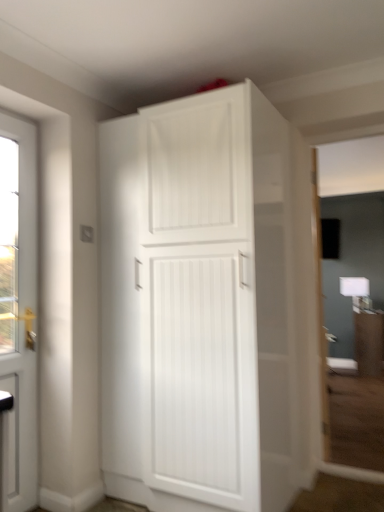
Question: Considering the relative sizes of matte white cabinet at center and white matte cabinet at upper center in the image provided, is matte white cabinet at center thinner than white matte cabinet at upper center?

Choices:
 (A) yes
 (B) no

Answer: (A)

Question: Considering the relative positions of matte white cabinet at center and white matte cabinet at upper center in the image provided, is matte white cabinet at center to the right of white matte cabinet at upper center from the viewer's perspective?

Choices:
 (A) no
 (B) yes

Answer: (B)

Question: Considering the relative sizes of matte white cabinet at center and white matte cabinet at upper center in the image provided, is matte white cabinet at center shorter than white matte cabinet at upper center?

Choices:
 (A) yes
 (B) no

Answer: (A)

Question: From the image's perspective, is matte white cabinet at center on white matte cabinet at upper center?

Choices:
 (A) no
 (B) yes

Answer: (A)

Question: From the image's perspective, does matte white cabinet at center appear lower than white matte cabinet at upper center?

Choices:
 (A) yes
 (B) no

Answer: (A)

Question: Considering the positions of point (11, 144) and point (360, 359), is point (11, 144) closer or farther from the camera than point (360, 359)?

Choices:
 (A) closer
 (B) farther

Answer: (A)

Question: Visually, is white glossy door at left positioned to the left or to the right of matte white cabinet at center?

Choices:
 (A) right
 (B) left

Answer: (B)

Question: Looking at the image, does white glossy door at left seem bigger or smaller compared to matte white cabinet at center?

Choices:
 (A) small
 (B) big

Answer: (A)

Question: From a real-world perspective, is white glossy door at left above or below matte white cabinet at center?

Choices:
 (A) above
 (B) below

Answer: (A)

Question: Considering their positions, is matte white cabinet at center located in front of or behind white glossy door at left?

Choices:
 (A) front
 (B) behind

Answer: (B)

Question: From the image's perspective, relative to white glossy door at left, is matte white cabinet at center above or below?

Choices:
 (A) below
 (B) above

Answer: (A)

Question: Considering the relative positions of matte white cabinet at center and white glossy door at left in the image provided, is matte white cabinet at center to the left or to the right of white glossy door at left?

Choices:
 (A) right
 (B) left

Answer: (A)

Question: Considering the positions of matte white cabinet at center and white glossy door at left in the image, is matte white cabinet at center bigger or smaller than white glossy door at left?

Choices:
 (A) small
 (B) big

Answer: (B)

Question: In terms of size, does white matte cabinet at upper center appear bigger or smaller than white glossy door at left?

Choices:
 (A) big
 (B) small

Answer: (A)

Question: Is white matte cabinet at upper center inside or outside of white glossy door at left?

Choices:
 (A) inside
 (B) outside

Answer: (B)